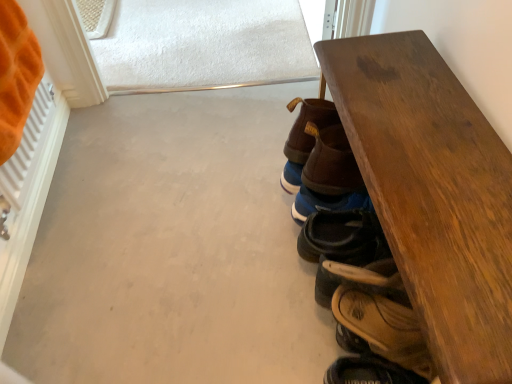
Locate an element on the screen. This screenshot has height=384, width=512. free point above wooden table at right (from a real-world perspective) is located at coordinates (449, 180).